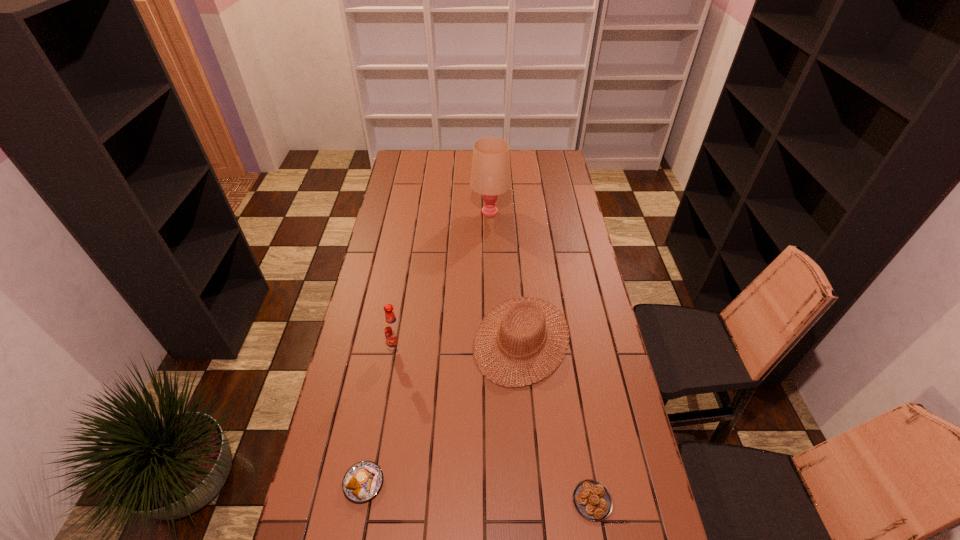
Image resolution: width=960 pixels, height=540 pixels. In order to click on lampshade in this screenshot , I will do `click(491, 172)`.

Identify the location of the tallest object. This screenshot has height=540, width=960. pos(491,172).

Identify the location of the fourth shortest object. (393, 330).

At what (x,y) coordinates should I click in order to perform the action: click on sunhat. Please return your answer as a coordinate pair (x, y). This screenshot has width=960, height=540. Looking at the image, I should click on (537, 311).

Image resolution: width=960 pixels, height=540 pixels. I want to click on the taller pastry, so click(x=363, y=480).

Locate an element on the screen. The height and width of the screenshot is (540, 960). the left pastry is located at coordinates (363, 480).

Identify the location of the shorter pastry. (592, 499).

Locate an element on the screen. The image size is (960, 540). the shortest object is located at coordinates (592, 499).

Where is `vacant region located 0.400m on the back of the tallest object`? Image resolution: width=960 pixels, height=540 pixels. vacant region located 0.400m on the back of the tallest object is located at coordinates (489, 157).

Locate an element on the screen. free point located on the right of the root beer is located at coordinates (470, 349).